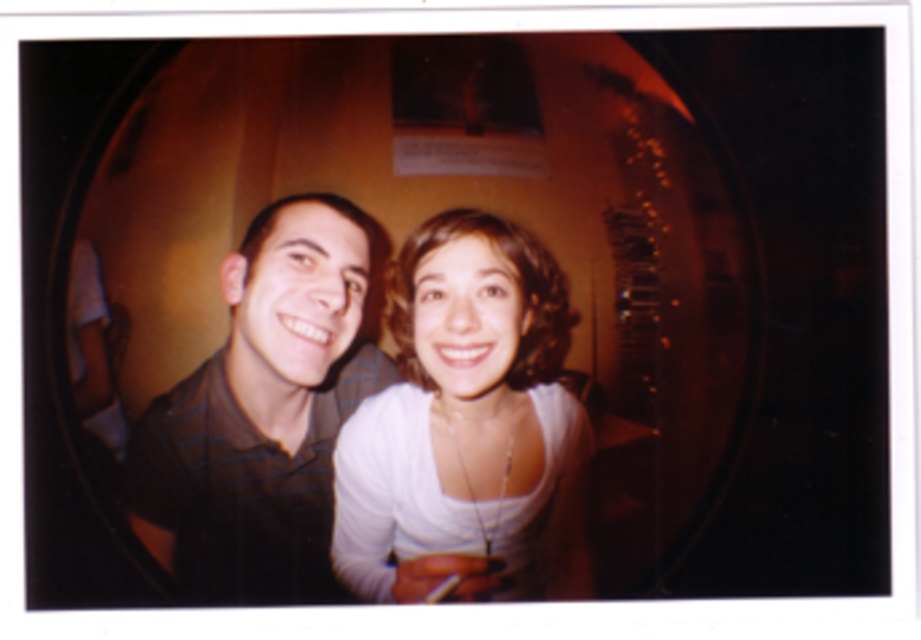
Question: Which object is closer to the camera taking this photo?

Choices:
 (A) white matte shirt at center
 (B) black striped shirt at center

Answer: (B)

Question: Which point appears closest to the camera in this image?

Choices:
 (A) (558, 480)
 (B) (223, 568)

Answer: (B)

Question: Can you confirm if white matte shirt at center is positioned to the right of black striped shirt at center?

Choices:
 (A) yes
 (B) no

Answer: (A)

Question: Which point is farther to the camera?

Choices:
 (A) black striped shirt at center
 (B) white matte shirt at center

Answer: (B)

Question: Can you confirm if white matte shirt at center is wider than black striped shirt at center?

Choices:
 (A) no
 (B) yes

Answer: (A)

Question: Does white matte shirt at center have a larger size compared to black striped shirt at center?

Choices:
 (A) no
 (B) yes

Answer: (A)